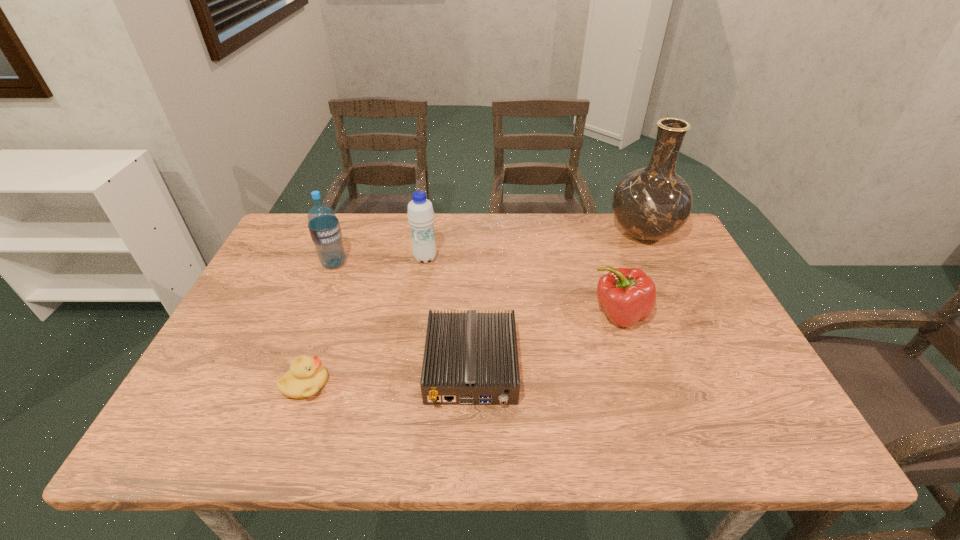
In order to click on free space at the far left corner in this screenshot , I will do `click(290, 218)`.

Identify the location of free location at the near left corner of the desktop. (206, 414).

This screenshot has width=960, height=540. I want to click on free region at the far right corner of the desktop, so click(x=655, y=245).

You are a GUI agent. You are given a task and a screenshot of the screen. Output one action in this format:
    pyautogui.click(x=<x>, y=<y>)
    Task: Click on the empty space between the duckling and the router
    This screenshot has height=540, width=960.
    Given the screenshot: What is the action you would take?
    pyautogui.click(x=389, y=375)

Find the location of a particular element. The height and width of the screenshot is (540, 960). vacant point located between the tallest object and the duckling is located at coordinates (474, 309).

Where is `free spot between the tallest object and the left water bottle`? The image size is (960, 540). free spot between the tallest object and the left water bottle is located at coordinates (489, 248).

You are a GUI agent. You are given a task and a screenshot of the screen. Output one action in this format:
    pyautogui.click(x=<x>, y=<y>)
    Task: Click on the free space between the left water bottle and the fourth object from left to right
    This screenshot has height=540, width=960.
    Given the screenshot: What is the action you would take?
    pyautogui.click(x=403, y=315)

I want to click on free point between the left water bottle and the vase, so click(x=489, y=248).

The width and height of the screenshot is (960, 540). In order to click on vacant space that is in between the pepper and the fourth object from right to left in this screenshot , I will do `click(522, 286)`.

Where is `free space between the router and the duckling`? free space between the router and the duckling is located at coordinates (389, 375).